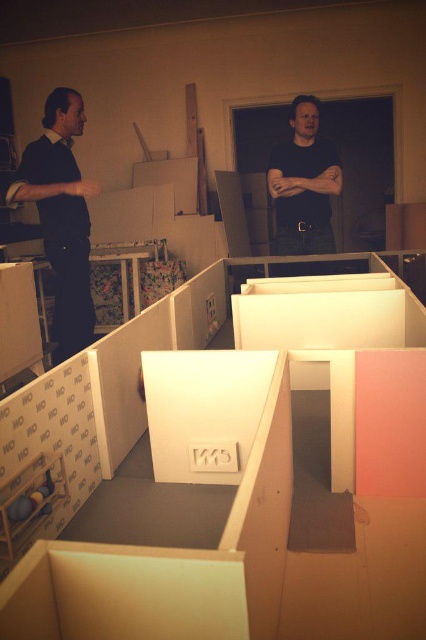
Question: Considering the relative positions of matte black shirt at left and dark gray shirt at center in the image provided, where is matte black shirt at left located with respect to dark gray shirt at center?

Choices:
 (A) above
 (B) below

Answer: (B)

Question: Can you confirm if matte black shirt at left is bigger than dark gray shirt at center?

Choices:
 (A) no
 (B) yes

Answer: (B)

Question: In this image, where is matte black shirt at left located relative to dark gray shirt at center?

Choices:
 (A) above
 (B) below

Answer: (B)

Question: Which of the following is the closest to the observer?

Choices:
 (A) (72, 221)
 (B) (310, 189)

Answer: (A)

Question: Which object appears closest to the camera in this image?

Choices:
 (A) dark gray shirt at center
 (B) matte black shirt at left

Answer: (B)